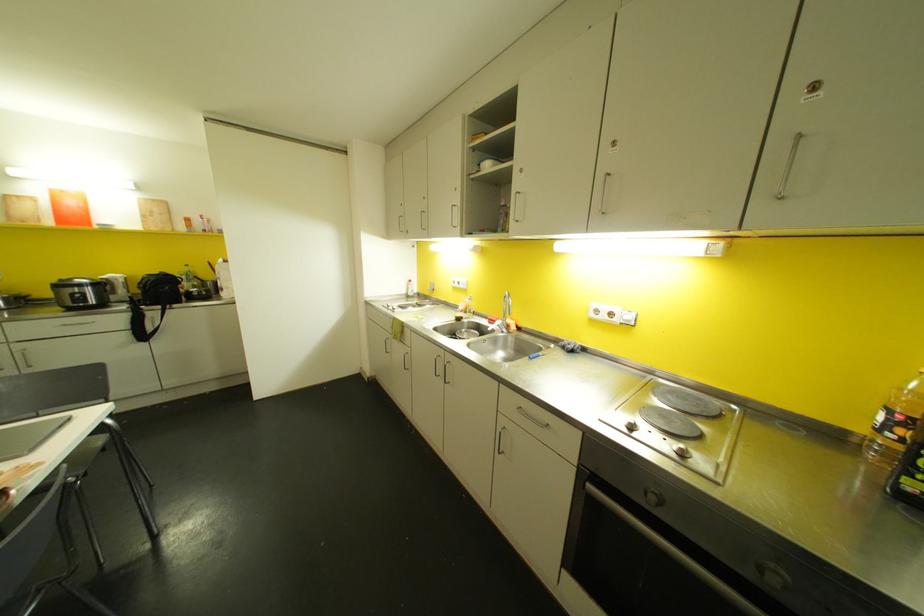
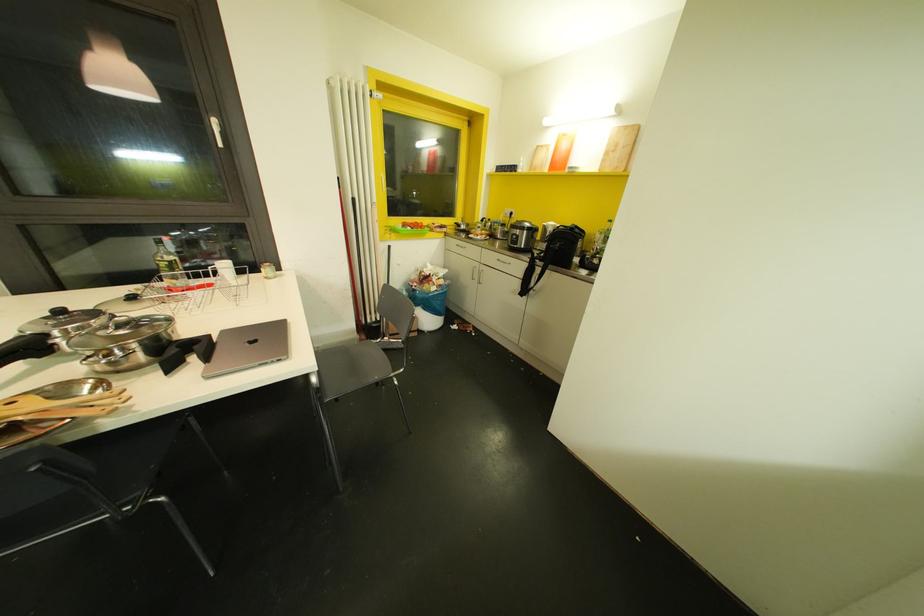
Find the pixel in the second image that matches [153,229] in the first image.

(606, 169)